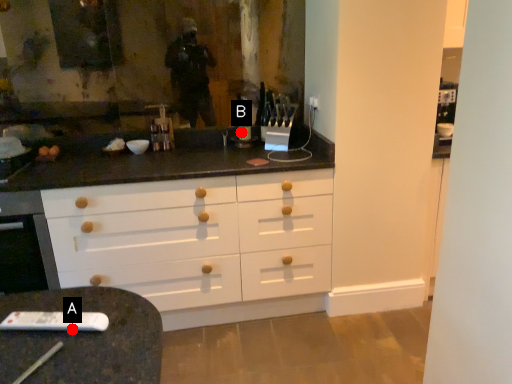
Question: Two points are circled on the image, labeled by A and B beside each circle. Which of the following is the closest to the observer?

Choices:
 (A) A is closer
 (B) B is closer

Answer: (A)